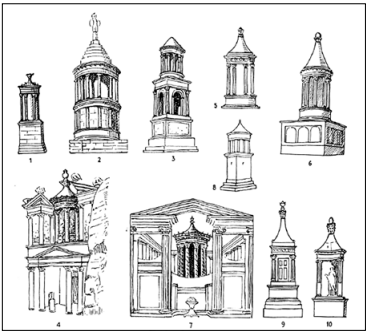
Identify the location of columns. This screenshot has height=334, width=371. (204, 256), (195, 257), (186, 259), (181, 261).